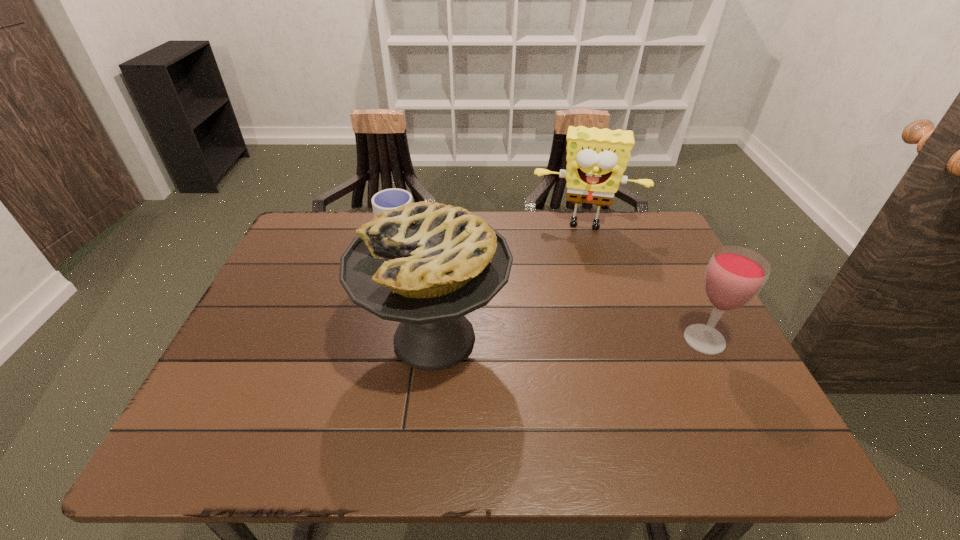
The image size is (960, 540). I want to click on vacant space located 0.310m with the handle on the side of the shortest object, so (492, 302).

Locate an element on the screen. This screenshot has width=960, height=540. vacant point located on the front-facing side of the sponge is located at coordinates (573, 291).

Where is `vacant position located on the front-facing side of the sponge`? vacant position located on the front-facing side of the sponge is located at coordinates (571, 310).

Locate an element on the screen. The image size is (960, 540). blank space located 0.150m on the front-facing side of the sponge is located at coordinates (575, 269).

You are a GUI agent. You are given a task and a screenshot of the screen. Output one action in this format:
    pyautogui.click(x=<x>, y=<y>)
    Task: Click on the cup present at the far edge
    The height and width of the screenshot is (540, 960).
    Given the screenshot: What is the action you would take?
    pyautogui.click(x=387, y=199)

Identify the location of sponge that is at the far edge. (596, 158).

The image size is (960, 540). I want to click on object at the near edge, so click(x=426, y=264).

The image size is (960, 540). In order to click on wineglass that is at the right edge in this screenshot , I will do `click(734, 276)`.

Find the location of a particular element. This screenshot has width=960, height=540. sponge that is at the right edge is located at coordinates (596, 158).

The width and height of the screenshot is (960, 540). I want to click on object present at the far right corner, so click(596, 158).